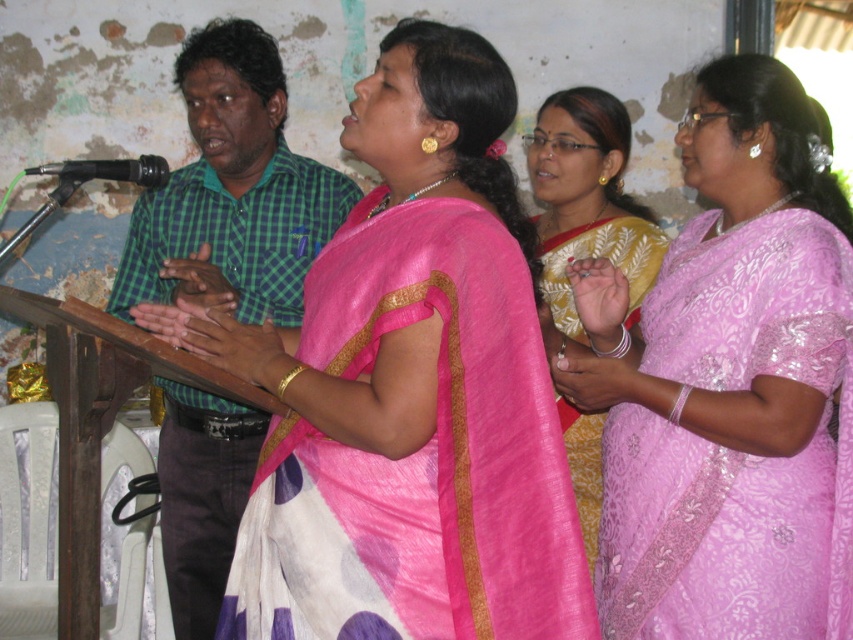
Can you confirm if pink silk saree at center is thinner than pink satin saree at upper right?

No.

This screenshot has height=640, width=853. Find the location of `pink silk saree at center`. pink silk saree at center is located at coordinates (410, 390).

Image resolution: width=853 pixels, height=640 pixels. I want to click on pink silk saree at center, so click(x=410, y=390).

Does green checkered shirt at left have a lesser height compared to yellow silk saree at center?

No, green checkered shirt at left is not shorter than yellow silk saree at center.

Does green checkered shirt at left appear under yellow silk saree at center?

Yes.

Is point (154, 268) positioned in front of point (602, 225)?

That is True.

You are a GUI agent. You are given a task and a screenshot of the screen. Output one action in this format:
    pyautogui.click(x=<x>, y=<y>)
    Task: Click on the green checkered shirt at left
    Image resolution: width=853 pixels, height=640 pixels.
    Given the screenshot: What is the action you would take?
    tap(231, 192)

Which is more to the left, pink silk saree at center or black matte microphone at left?

Positioned to the left is black matte microphone at left.

Between point (496, 465) and point (71, 177), which one is positioned in front?

Point (496, 465) is more forward.

Measure the distance between pink silk saree at center and camera.

pink silk saree at center and camera are 1.76 meters apart from each other.

Where is `pink silk saree at center`? This screenshot has height=640, width=853. pink silk saree at center is located at coordinates (410, 390).